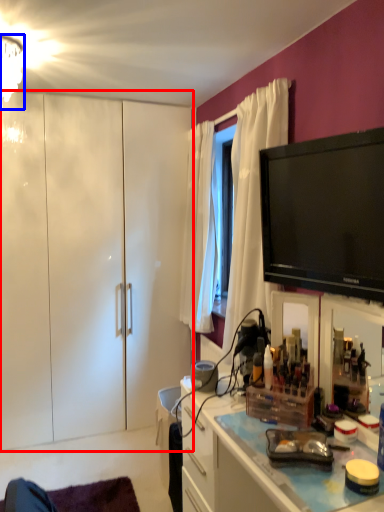
Question: Which object is closer to the camera taking this photo, cabinetry (highlighted by a red box) or lamp (highlighted by a blue box)?

Choices:
 (A) cabinetry
 (B) lamp

Answer: (B)